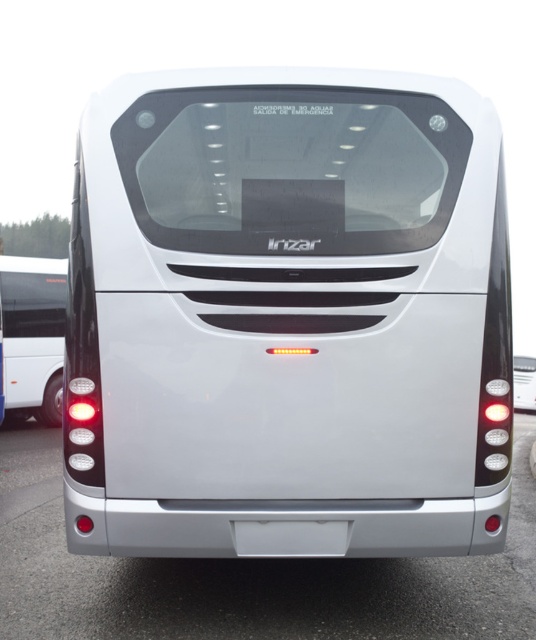
Who is lower down, white glossy bus at center or silver metallic bus at left?

silver metallic bus at left

How far apart are white glossy bus at center and silver metallic bus at left?

11.08 feet

Is point (435, 440) positioned before point (13, 266)?

That is True.

This screenshot has height=640, width=536. What are the coordinates of `white glossy bus at center` in the screenshot? It's located at (287, 317).

Between glossy metallic bus at lower center and silver metallic bus at left, which one has less height?

glossy metallic bus at lower center

Between glossy metallic bus at lower center and silver metallic bus at left, which one appears on the left side from the viewer's perspective?

Positioned to the left is silver metallic bus at left.

The height and width of the screenshot is (640, 536). In order to click on glossy metallic bus at lower center in this screenshot , I will do click(x=247, y=576).

Consider the image. Does white glossy bus at center have a larger size compared to glossy metallic bus at lower center?

Yes.

Between point (450, 140) and point (57, 529), which one is positioned in front?

Point (450, 140) is in front.

Is point (233, 193) more distant than point (105, 596)?

No, (233, 193) is in front of (105, 596).

The height and width of the screenshot is (640, 536). I want to click on white glossy bus at center, so click(x=287, y=317).